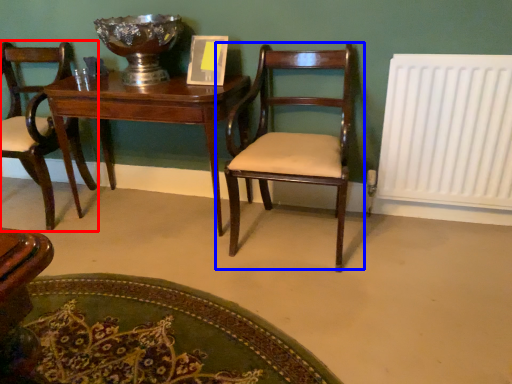
Question: Which point is closer to the camera, chair (highlighted by a red box) or chair (highlighted by a blue box)?

Choices:
 (A) chair
 (B) chair

Answer: (B)